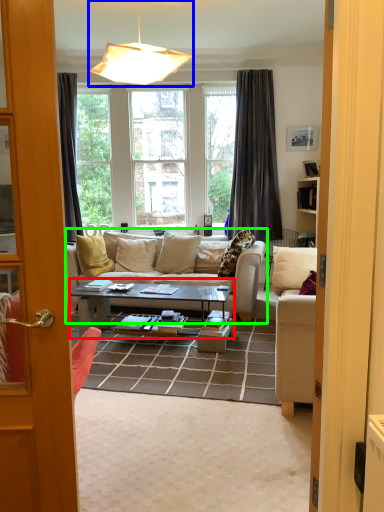
Question: Which is nearer to the coffee table (highlighted by a red box)? lamp (highlighted by a blue box) or studio couch (highlighted by a green box).

Choices:
 (A) lamp
 (B) studio couch

Answer: (B)